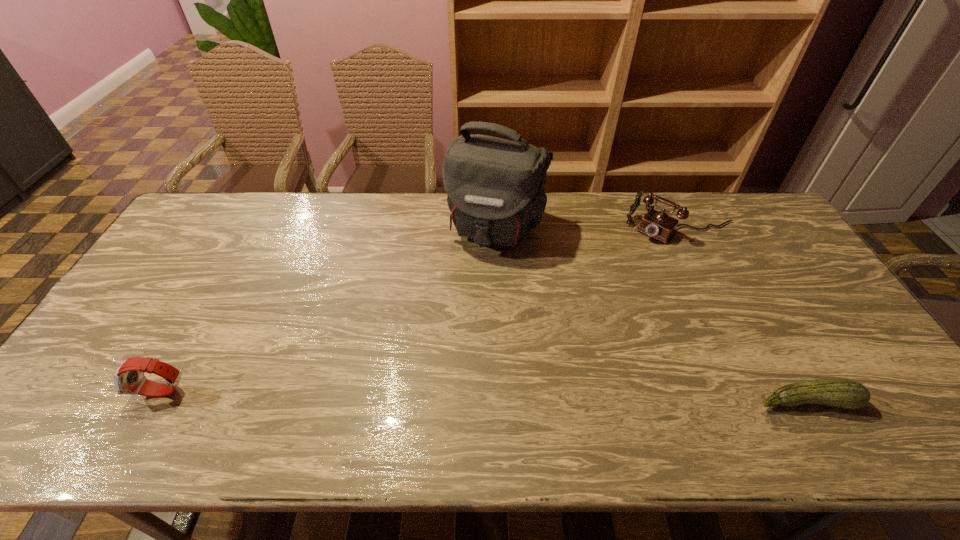
What are the coordinates of `vacant space on the desktop that is between the watch and the zucchini and is positioned on the open flap of the second object from left to right` in the screenshot? It's located at (425, 396).

The width and height of the screenshot is (960, 540). Find the location of `vacant space on the desktop that is between the leftmost object and the zucchini and is positioned on the dial of the telephone`. vacant space on the desktop that is between the leftmost object and the zucchini and is positioned on the dial of the telephone is located at coordinates (536, 397).